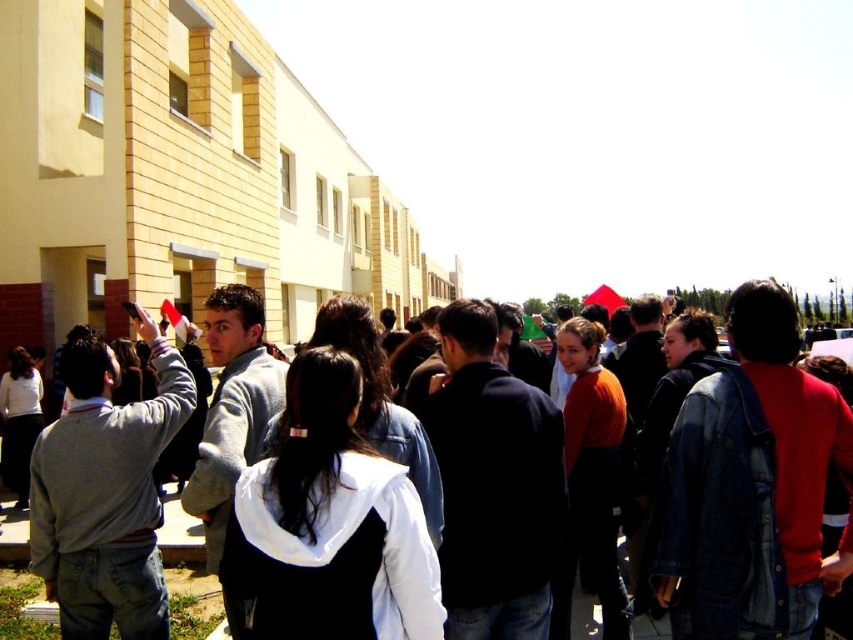
Question: Which point is farther to the camera?

Choices:
 (A) white matte jacket at center
 (B) denim jacket at center

Answer: (B)

Question: Is white matte jacket at center to the left of denim jacket at center from the viewer's perspective?

Choices:
 (A) yes
 (B) no

Answer: (A)

Question: Does white matte jacket at center appear on the left side of denim jacket at center?

Choices:
 (A) yes
 (B) no

Answer: (A)

Question: Which object is farther from the camera taking this photo?

Choices:
 (A) denim jacket at center
 (B) white matte jacket at center

Answer: (A)

Question: Is white matte jacket at center in front of denim jacket at center?

Choices:
 (A) yes
 (B) no

Answer: (A)

Question: Which point appears farthest from the camera in this image?

Choices:
 (A) (358, 392)
 (B) (28, 621)

Answer: (B)